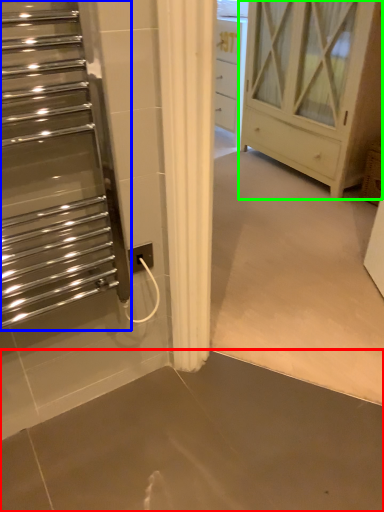
Question: Considering the real-world distances, which object is closest to concrete (highlighted by a red box)? escalator (highlighted by a blue box) or chest of drawers (highlighted by a green box).

Choices:
 (A) escalator
 (B) chest of drawers

Answer: (A)